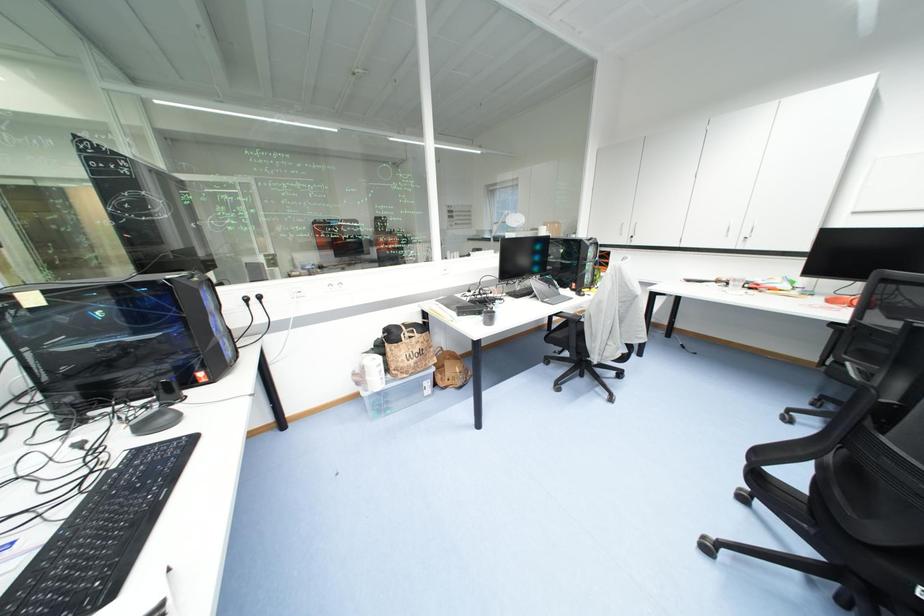
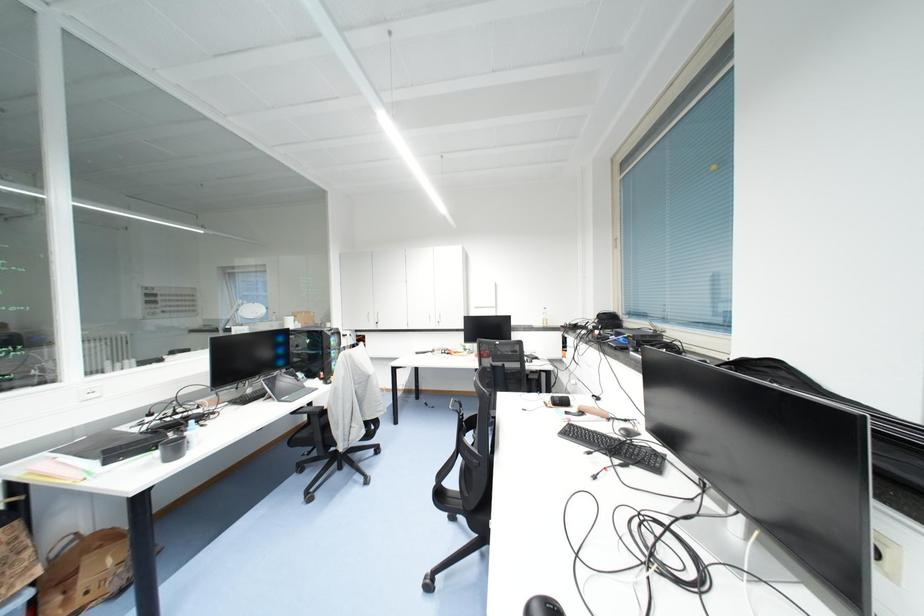
Question: How did the camera likely rotate?

Choices:
 (A) Left
 (B) Right
 (C) Up
 (D) Down

Answer: (B)